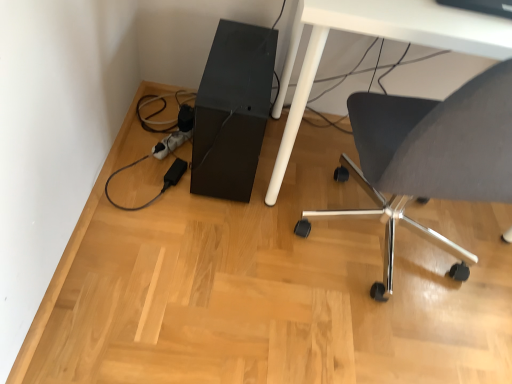
Question: From a real-world perspective, is matte gray chair at lower right positioned above or below white glossy table at lower right?

Choices:
 (A) above
 (B) below

Answer: (A)

Question: From the image's perspective, is matte gray chair at lower right above or below white glossy table at lower right?

Choices:
 (A) above
 (B) below

Answer: (B)

Question: Which is farther from the matte gray chair at lower right?

Choices:
 (A) white glossy table at lower right
 (B) black matte computer tower at lower center

Answer: (B)

Question: Estimate the real-world distances between objects in this image. Which object is closer to the white glossy table at lower right?

Choices:
 (A) black matte computer tower at lower center
 (B) matte gray chair at lower right

Answer: (A)